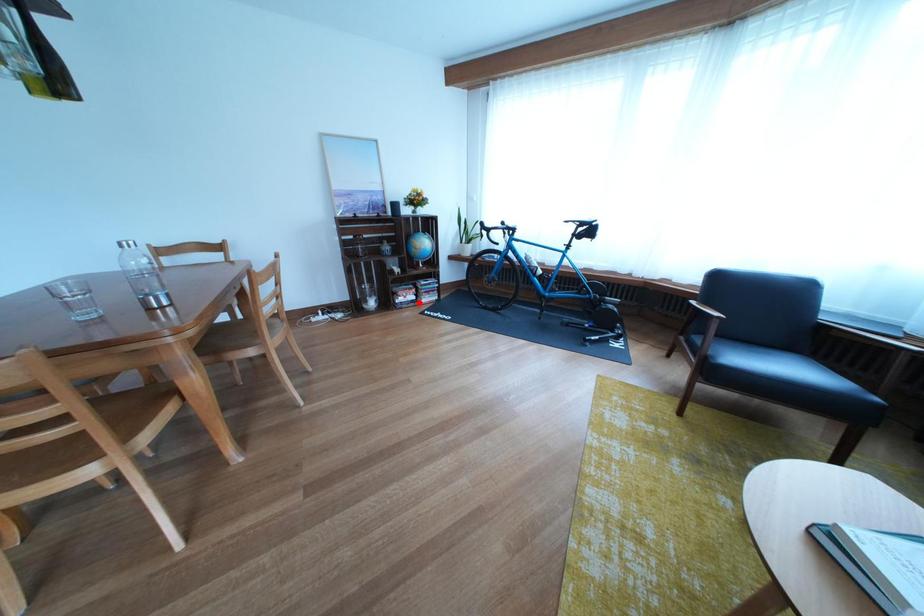
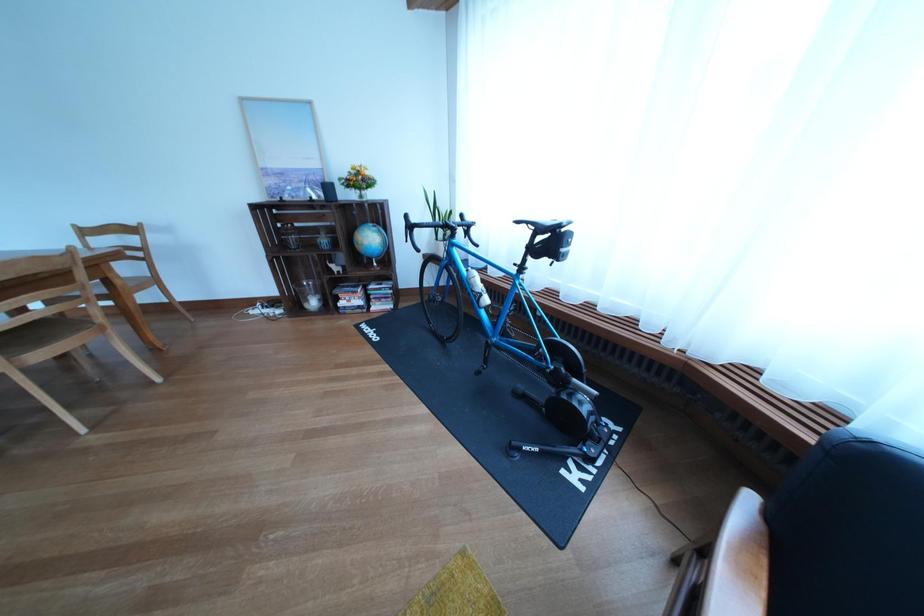
In the second image, find the point that corresponds to the highlighted location in the first image.

(363, 306)